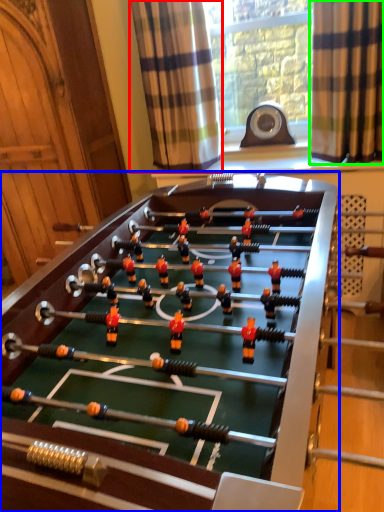
Question: Based on their relative distances, which object is nearer to curtain (highlighted by a red box)? Choose from table (highlighted by a blue box) and curtain (highlighted by a green box).

Choices:
 (A) table
 (B) curtain

Answer: (B)